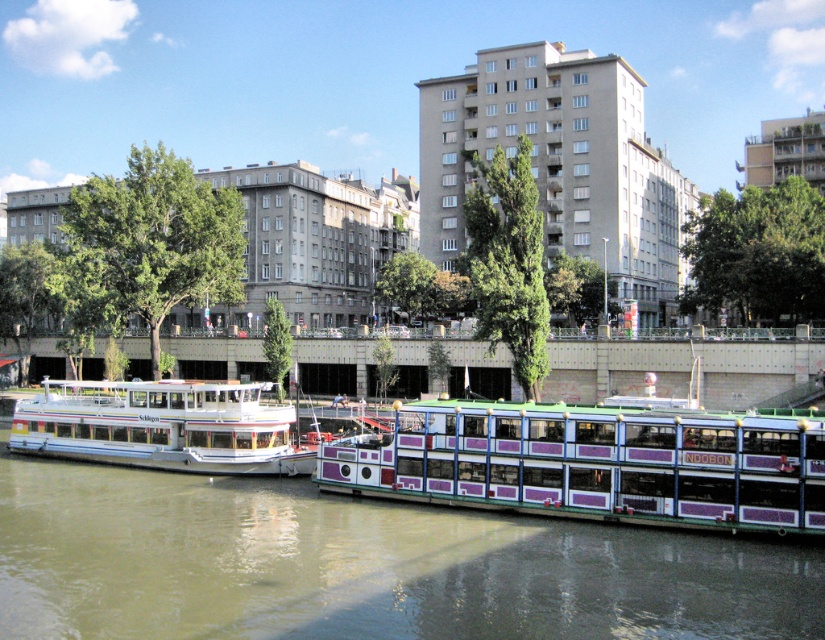
What do you see at coordinates (595, 461) in the screenshot? The width and height of the screenshot is (825, 640). I see `purple painted glass boat at center` at bounding box center [595, 461].

Which is in front, point (545, 420) or point (210, 474)?

Positioned in front is point (545, 420).

Locate an element on the screen. Image resolution: width=825 pixels, height=640 pixels. purple painted glass boat at center is located at coordinates (595, 461).

Can you confirm if greenish-brown water at center is thinner than white glossy boat at left?

No, greenish-brown water at center is not thinner than white glossy boat at left.

Can you confirm if greenish-brown water at center is positioned above white glossy boat at left?

No.

Does point (811, 541) lie in front of point (120, 390)?

Yes.

The image size is (825, 640). I want to click on greenish-brown water at center, so click(363, 564).

Which of these two, greenish-brown water at center or purple painted glass boat at center, stands taller?

purple painted glass boat at center

Does greenish-brown water at center lie in front of purple painted glass boat at center?

Yes, greenish-brown water at center is closer to the viewer.

Does point (342, 522) come behind point (505, 493)?

That is True.

The width and height of the screenshot is (825, 640). Identify the location of greenish-brown water at center. (363, 564).